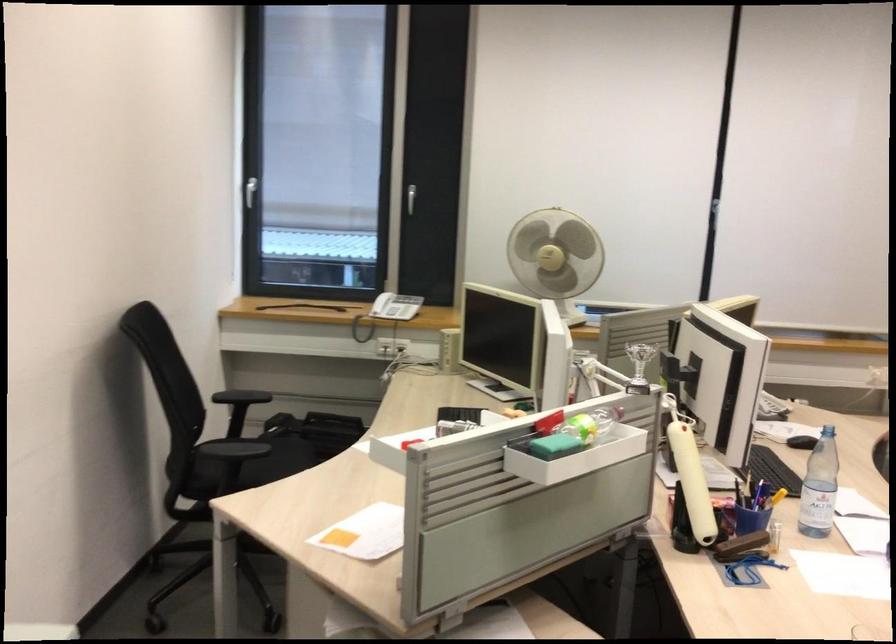
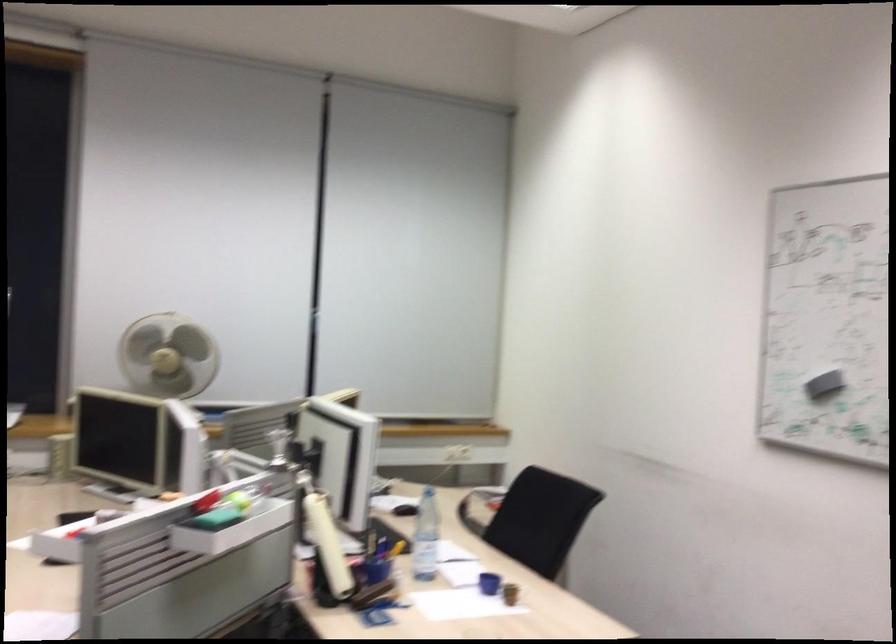
Where in the second image is the point corresponding to point 699,478 from the first image?

(328, 545)